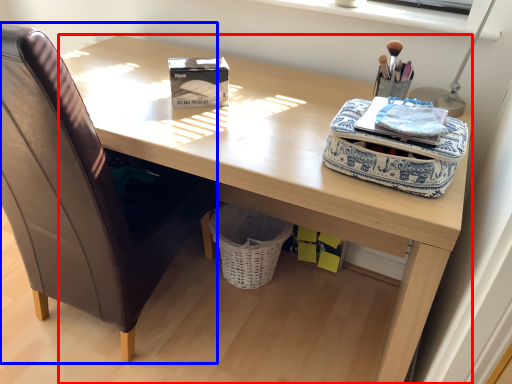
Question: Which point is further to the camera, desk (highlighted by a red box) or chair (highlighted by a blue box)?

Choices:
 (A) desk
 (B) chair

Answer: (A)